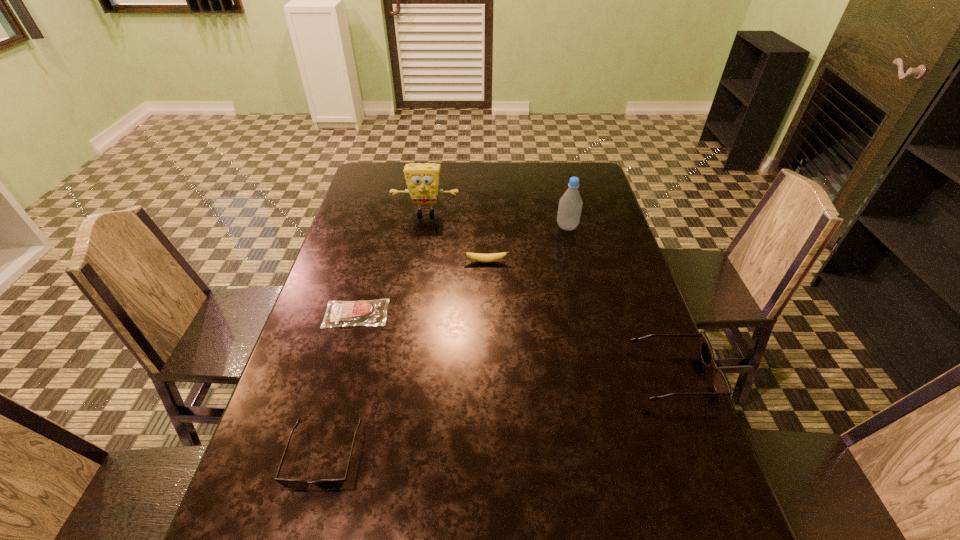
If we want them evenly spaced by inserting an extra sunglasses among them, please locate a free spot for this new sunglasses. Please provide its 2D coordinates. Your answer should be formatted as a tuple, i.e. [(x, y)], where the tuple contains the x and y coordinates of a point satisfying the conditions above.

[(512, 413)]